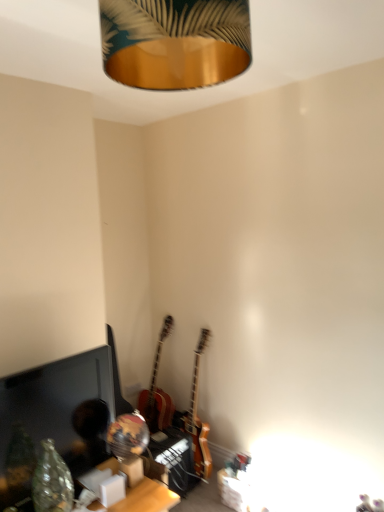
What do you see at coordinates (197, 418) in the screenshot?
I see `wooden electric guitar at center, which ranks as the second guitar in left-to-right order` at bounding box center [197, 418].

Describe the element at coordinates (156, 390) in the screenshot. The image size is (384, 512). I see `wooden acoustic guitar at center, the first guitar viewed from the left` at that location.

This screenshot has height=512, width=384. Describe the element at coordinates (174, 42) in the screenshot. I see `gold metallic lampshade at upper center` at that location.

Locate an element on the screen. The height and width of the screenshot is (512, 384). wooden table at lower center is located at coordinates (143, 498).

From the image's perspective, relative to matte black monitor at lower left, is wooden acoustic guitar at center, the first guitar viewed from the left, above or below?

wooden acoustic guitar at center, the first guitar viewed from the left, is below matte black monitor at lower left.

Is matte black monitor at lower left located within wooden acoustic guitar at center, which is counted as the second guitar, starting from the right?

No, matte black monitor at lower left is not inside wooden acoustic guitar at center, which is counted as the second guitar, starting from the right.

What's the angular difference between wooden acoustic guitar at center, which is counted as the second guitar, starting from the right, and matte black monitor at lower left's facing directions?

97.2 degrees.

Find the location of `computer monitor in front of the wooden acoustic guitar at center, which is counted as the second guitar, starting from the right`. computer monitor in front of the wooden acoustic guitar at center, which is counted as the second guitar, starting from the right is located at coordinates (55, 407).

How different are the orientations of wooden electric guitar at center, the 1th guitar positioned from the right, and gold metallic lampshade at upper center in degrees?

The facing directions of wooden electric guitar at center, the 1th guitar positioned from the right, and gold metallic lampshade at upper center are 93.3 degrees apart.

Is wooden electric guitar at center, which ranks as the second guitar in left-to-right order, positioned far away from gold metallic lampshade at upper center?

wooden electric guitar at center, which ranks as the second guitar in left-to-right order, is positioned a significant distance from gold metallic lampshade at upper center.

Based on the photo, is wooden electric guitar at center, which ranks as the second guitar in left-to-right order, not inside gold metallic lampshade at upper center?

Absolutely, wooden electric guitar at center, which ranks as the second guitar in left-to-right order, is external to gold metallic lampshade at upper center.

Is point (200, 460) farther from viewer compared to point (139, 80)?

That is True.

In terms of height, does wooden electric guitar at center, the 1th guitar positioned from the right, look taller or shorter compared to matte black monitor at lower left?

Clearly, wooden electric guitar at center, the 1th guitar positioned from the right, is taller compared to matte black monitor at lower left.

Who is bigger, wooden electric guitar at center, the 1th guitar positioned from the right, or matte black monitor at lower left?

With larger size is wooden electric guitar at center, the 1th guitar positioned from the right.

Which of these two, wooden electric guitar at center, which ranks as the second guitar in left-to-right order, or matte black monitor at lower left, is thinner?

Thinner between the two is matte black monitor at lower left.

Identify the location of the 2nd guitar positioned below the matte black monitor at lower left (from a real-world perspective). This screenshot has height=512, width=384. (197, 418).

Which point is more distant from viewer, (88, 460) or (194, 457)?

The point (194, 457) is behind.

From the image's perspective, is matte black monitor at lower left above or below wooden electric guitar at center, the 1th guitar positioned from the right?

matte black monitor at lower left is above wooden electric guitar at center, the 1th guitar positioned from the right.

In the scene shown: Looking at the image, does matte black monitor at lower left seem bigger or smaller compared to wooden electric guitar at center, which ranks as the second guitar in left-to-right order?

Considering their sizes, matte black monitor at lower left takes up less space than wooden electric guitar at center, which ranks as the second guitar in left-to-right order.

Is matte black monitor at lower left further to the viewer compared to wooden electric guitar at center, the 1th guitar positioned from the right?

No, the depth of matte black monitor at lower left is less than that of wooden electric guitar at center, the 1th guitar positioned from the right.

From their relative heights in the image, would you say wooden electric guitar at center, the 1th guitar positioned from the right, is taller or shorter than wooden table at lower center?

In the image, wooden electric guitar at center, the 1th guitar positioned from the right, appears to be taller than wooden table at lower center.

Is wooden electric guitar at center, the 1th guitar positioned from the right, positioned far away from wooden table at lower center?

That's not correct — wooden electric guitar at center, the 1th guitar positioned from the right, is a little close to wooden table at lower center.

Is wooden electric guitar at center, the 1th guitar positioned from the right, facing away from wooden table at lower center?

No.

From a real-world perspective, which is physically below, wooden acoustic guitar at center, the first guitar viewed from the left, or wooden electric guitar at center, which ranks as the second guitar in left-to-right order?

In real-world perspective, wooden electric guitar at center, which ranks as the second guitar in left-to-right order, is lower.

Considering the relative positions of wooden acoustic guitar at center, which is counted as the second guitar, starting from the right, and wooden electric guitar at center, the 1th guitar positioned from the right, in the image provided, is wooden acoustic guitar at center, which is counted as the second guitar, starting from the right, to the left or to the right of wooden electric guitar at center, the 1th guitar positioned from the right,?

wooden acoustic guitar at center, which is counted as the second guitar, starting from the right, is to the left of wooden electric guitar at center, the 1th guitar positioned from the right.

Considering the relative sizes of wooden acoustic guitar at center, the first guitar viewed from the left, and wooden electric guitar at center, the 1th guitar positioned from the right, in the image provided, is wooden acoustic guitar at center, the first guitar viewed from the left, smaller than wooden electric guitar at center, the 1th guitar positioned from the right,?

No, wooden acoustic guitar at center, the first guitar viewed from the left, is not smaller than wooden electric guitar at center, the 1th guitar positioned from the right.

Consider the image. Visually, is gold metallic lampshade at upper center positioned to the left or to the right of matte black monitor at lower left?

gold metallic lampshade at upper center is to the right of matte black monitor at lower left.

Where is `lamp that is above the matte black monitor at lower left (from the image's perspective)`? lamp that is above the matte black monitor at lower left (from the image's perspective) is located at coordinates (174, 42).

How far apart are gold metallic lampshade at upper center and matte black monitor at lower left?

gold metallic lampshade at upper center and matte black monitor at lower left are 5.34 feet apart from each other.

The width and height of the screenshot is (384, 512). What are the coordinates of `the 1st guitar counting from the right of the matte black monitor at lower left` in the screenshot? It's located at (156, 390).

Which guitar is the 1st one when counting from the back of the gold metallic lampshade at upper center? Please provide its 2D coordinates.

[(197, 418)]

When comparing their distances from wooden acoustic guitar at center, which is counted as the second guitar, starting from the right, does wooden electric guitar at center, which ranks as the second guitar in left-to-right order, or gold metallic lampshade at upper center seem further?

Based on the image, gold metallic lampshade at upper center appears to be further to wooden acoustic guitar at center, which is counted as the second guitar, starting from the right.

When comparing their distances from gold metallic lampshade at upper center, does wooden electric guitar at center, which ranks as the second guitar in left-to-right order, or wooden table at lower center seem further?

wooden electric guitar at center, which ranks as the second guitar in left-to-right order.

Based on their spatial positions, is matte black monitor at lower left or wooden electric guitar at center, which ranks as the second guitar in left-to-right order, further from wooden acoustic guitar at center, which is counted as the second guitar, starting from the right?

Among the two, matte black monitor at lower left is located further to wooden acoustic guitar at center, which is counted as the second guitar, starting from the right.

When comparing their distances from gold metallic lampshade at upper center, does wooden acoustic guitar at center, which is counted as the second guitar, starting from the right, or matte black monitor at lower left seem closer?

matte black monitor at lower left is positioned closer to the anchor gold metallic lampshade at upper center.

Based on the photo, which object lies further to the anchor point wooden electric guitar at center, which ranks as the second guitar in left-to-right order, wooden table at lower center or wooden acoustic guitar at center, which is counted as the second guitar, starting from the right?

wooden table at lower center is positioned further to the anchor wooden electric guitar at center, which ranks as the second guitar in left-to-right order.

Which object lies further to the anchor point matte black monitor at lower left, wooden electric guitar at center, which ranks as the second guitar in left-to-right order, or gold metallic lampshade at upper center?

gold metallic lampshade at upper center lies further to matte black monitor at lower left than the other object.

Considering their positions, is wooden electric guitar at center, the 1th guitar positioned from the right, positioned further to gold metallic lampshade at upper center than wooden acoustic guitar at center, the first guitar viewed from the left?

wooden acoustic guitar at center, the first guitar viewed from the left, is positioned further to the anchor gold metallic lampshade at upper center.

When comparing their distances from matte black monitor at lower left, does wooden acoustic guitar at center, the first guitar viewed from the left, or gold metallic lampshade at upper center seem further?

Based on the image, gold metallic lampshade at upper center appears to be further to matte black monitor at lower left.

At what (x,y) coordinates should I click in order to perform the action: click on computer monitor between gold metallic lampshade at upper center and wooden acoustic guitar at center, the first guitar viewed from the left, in the front-back direction. Please return your answer as a coordinate pair (x, y). The width and height of the screenshot is (384, 512). Looking at the image, I should click on (55, 407).

I want to click on table located between gold metallic lampshade at upper center and wooden electric guitar at center, the 1th guitar positioned from the right, in the depth direction, so click(143, 498).

At what (x,y) coordinates should I click in order to perform the action: click on computer monitor between gold metallic lampshade at upper center and wooden electric guitar at center, the 1th guitar positioned from the right, along the z-axis. Please return your answer as a coordinate pair (x, y). Looking at the image, I should click on pos(55,407).

At what (x,y) coordinates should I click in order to perform the action: click on table positioned between gold metallic lampshade at upper center and wooden acoustic guitar at center, which is counted as the second guitar, starting from the right, from near to far. Please return your answer as a coordinate pair (x, y). The width and height of the screenshot is (384, 512). Looking at the image, I should click on (143, 498).